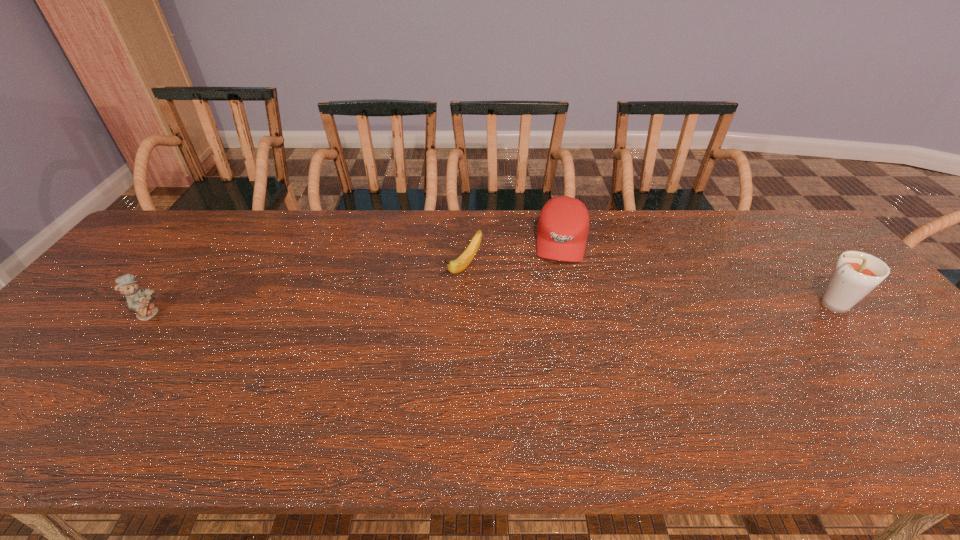
The width and height of the screenshot is (960, 540). I want to click on vacant point located between the second object from right to left and the root beer, so click(x=695, y=273).

At what (x,y) coordinates should I click in order to perform the action: click on free space between the second object from right to left and the leftmost object. Please return your answer as a coordinate pair (x, y). Looking at the image, I should click on (355, 277).

The height and width of the screenshot is (540, 960). Identify the location of vacant space in between the third object from left to right and the leftmost object. pos(355,277).

In order to click on free space between the cap and the teddy bear in this screenshot , I will do tap(355, 277).

Image resolution: width=960 pixels, height=540 pixels. What are the coordinates of `object that can be found as the third closest to the teddy bear` in the screenshot? It's located at (856, 274).

I want to click on the third closest object relative to the teddy bear, so click(856, 274).

At what (x,y) coordinates should I click in order to perform the action: click on free location that satisfies the following two spatial constraints: 1. on the back side of the second object from right to left; 2. on the left side of the third object from right to left. Please return your answer as a coordinate pair (x, y). This screenshot has height=540, width=960. Looking at the image, I should click on (466, 242).

You are a GUI agent. You are given a task and a screenshot of the screen. Output one action in this format:
    pyautogui.click(x=<x>, y=<y>)
    Task: Click on the vacant region that satisfies the following two spatial constraints: 1. on the back side of the third object from left to right; 2. on the left side of the shortest object
    This screenshot has width=960, height=540.
    Given the screenshot: What is the action you would take?
    pyautogui.click(x=466, y=242)

You are a GUI agent. You are given a task and a screenshot of the screen. Output one action in this format:
    pyautogui.click(x=<x>, y=<y>)
    Task: Click on the free space that satisfies the following two spatial constraints: 1. on the front side of the shortest object; 2. on the drink side of the rightmost object
    This screenshot has width=960, height=540.
    Given the screenshot: What is the action you would take?
    pyautogui.click(x=464, y=305)

Find the location of a particular element. The width and height of the screenshot is (960, 540). vacant region that satisfies the following two spatial constraints: 1. on the front side of the tallest object; 2. on the drink side of the second object from left to right is located at coordinates (464, 305).